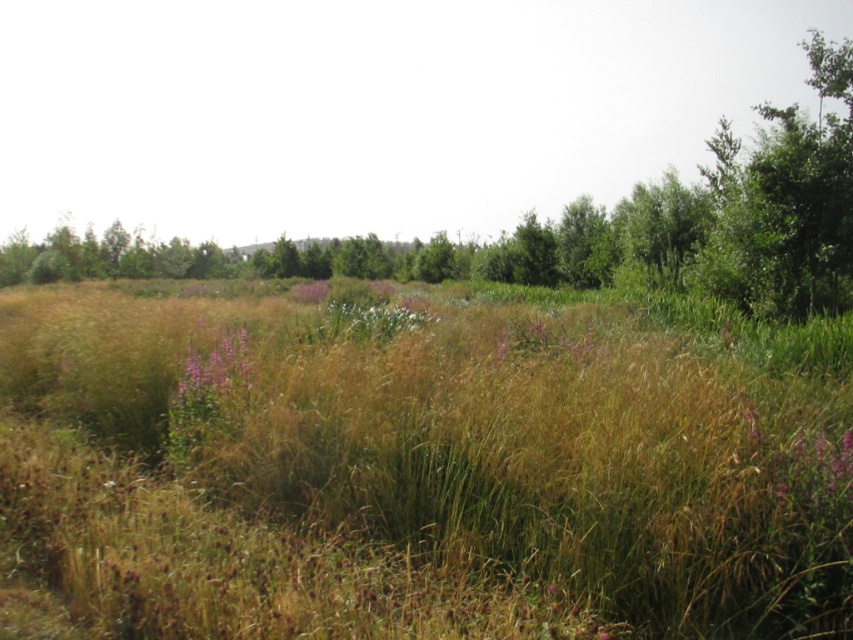
Question: Can you confirm if purple matte flower at center is thinner than purple soft flower at center?

Choices:
 (A) yes
 (B) no

Answer: (A)

Question: Can you confirm if purple matte flower at center is positioned to the right of purple soft flower at center?

Choices:
 (A) yes
 (B) no

Answer: (A)

Question: Among these objects, which one is farthest from the camera?

Choices:
 (A) purple matte flower at center
 (B) purple soft flower at center

Answer: (B)

Question: Can you confirm if purple matte flower at center is smaller than purple soft flower at center?

Choices:
 (A) yes
 (B) no

Answer: (A)